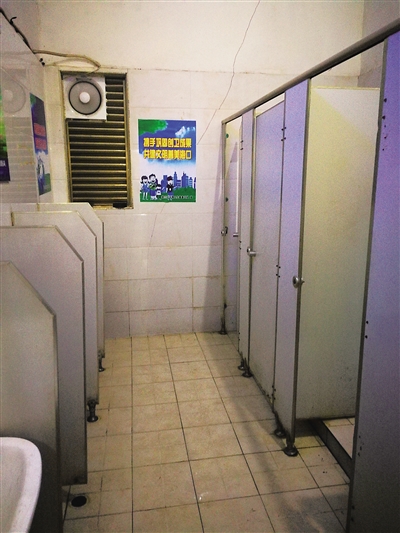
The image size is (400, 533). I want to click on poster, so click(187, 193).